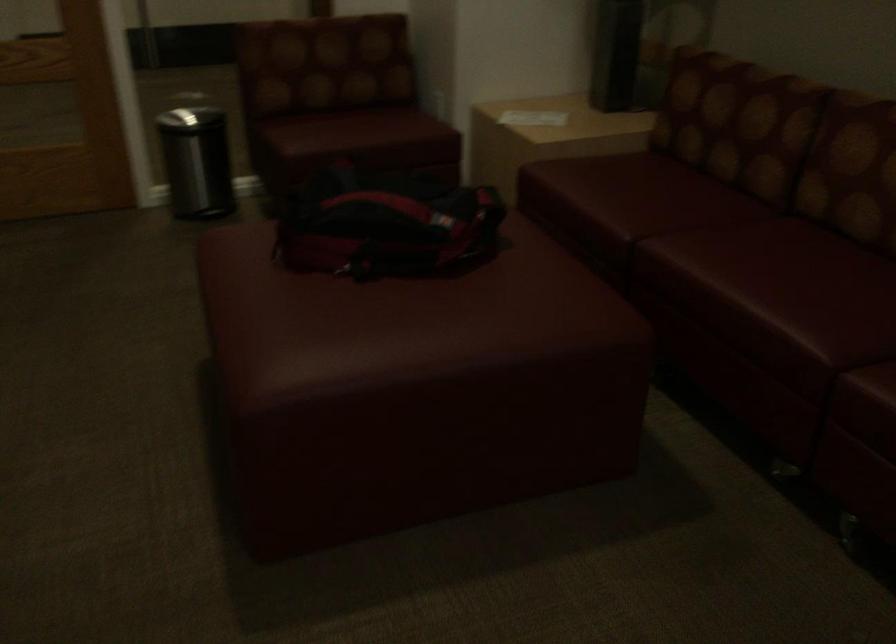
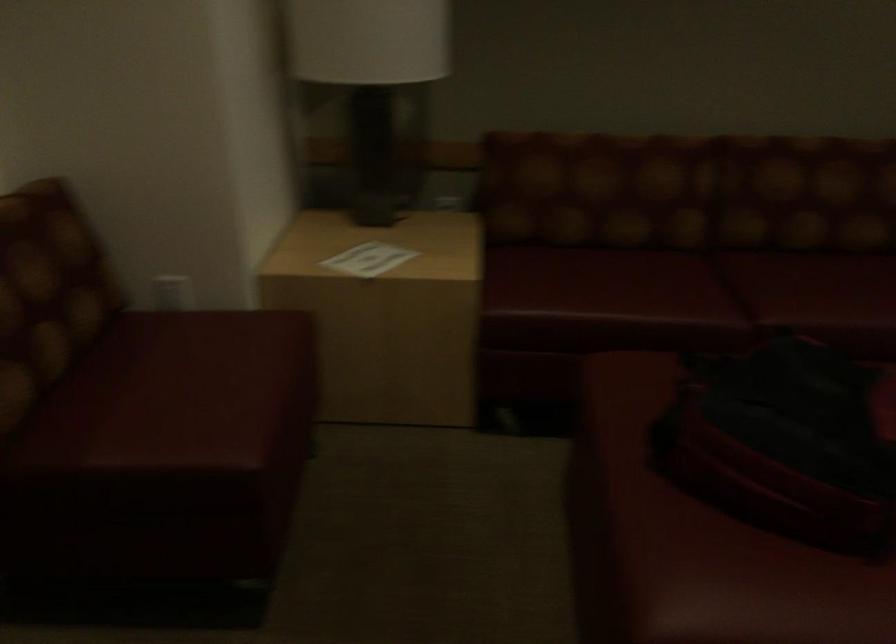
Question: I am providing you with two images of the same scene from different viewpoints. Please identify which objects are invisible in image2.

Choices:
 (A) red sofa sitting surface
 (B) white paper
 (C) ottoman sitting surface
 (D) none of these

Answer: (D)